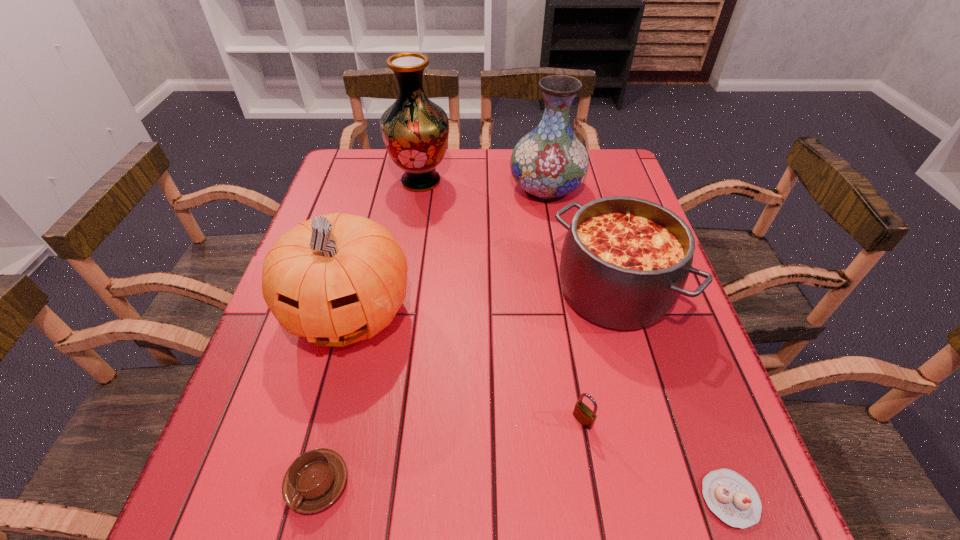
Image resolution: width=960 pixels, height=540 pixels. I want to click on free space that satisfies the following two spatial constraints: 1. on the front-facing side of the padlock; 2. on the left side of the pumpkin, so click(321, 421).

Where is `vacant space that satisfies the following two spatial constraints: 1. on the front-facing side of the third tallest object; 2. on the right side of the cupcake`? The width and height of the screenshot is (960, 540). vacant space that satisfies the following two spatial constraints: 1. on the front-facing side of the third tallest object; 2. on the right side of the cupcake is located at coordinates (300, 499).

Find the location of a particular element. This screenshot has width=960, height=540. vacant space that satisfies the following two spatial constraints: 1. on the front-facing side of the third tallest object; 2. on the right side of the shortest object is located at coordinates (300, 499).

Find the location of a particular element. The width and height of the screenshot is (960, 540). free space in the image that satisfies the following two spatial constraints: 1. on the side of the shortest object with the handle; 2. on the right side of the cappuccino is located at coordinates (313, 499).